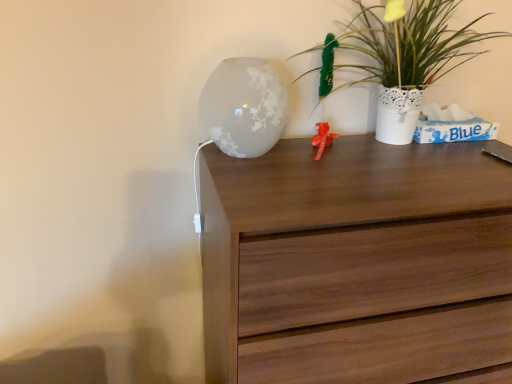
What do you see at coordinates (460, 57) in the screenshot?
I see `white textured vase at upper right` at bounding box center [460, 57].

Describe the element at coordinates (243, 107) in the screenshot. This screenshot has width=512, height=384. I see `frosted glass vase at upper center` at that location.

Where is `walnut wood chest of drawers at center`? walnut wood chest of drawers at center is located at coordinates (355, 262).

From the image's perspective, relative to white textured vase at upper right, is frosted glass vase at upper center above or below?

Based on their image positions, frosted glass vase at upper center is located beneath white textured vase at upper right.

Looking at the image, does frosted glass vase at upper center seem bigger or smaller compared to white textured vase at upper right?

Considering their sizes, frosted glass vase at upper center takes up less space than white textured vase at upper right.

Would you say frosted glass vase at upper center is a long distance from white textured vase at upper right?

Actually, frosted glass vase at upper center and white textured vase at upper right are a little close together.

Is frosted glass vase at upper center to the right of walnut wood chest of drawers at center from the viewer's perspective?

No, frosted glass vase at upper center is not to the right of walnut wood chest of drawers at center.

Is frosted glass vase at upper center surrounding walnut wood chest of drawers at center?

No, walnut wood chest of drawers at center is located outside of frosted glass vase at upper center.

Image resolution: width=512 pixels, height=384 pixels. Find the location of `chest of drawers that is on the right side of frosted glass vase at upper center`. chest of drawers that is on the right side of frosted glass vase at upper center is located at coordinates coord(355,262).

Which object is wider, white textured vase at upper right or frosted glass vase at upper center?

frosted glass vase at upper center.

From a real-world perspective, is white textured vase at upper right on frosted glass vase at upper center?

Indeed, from a real-world perspective, white textured vase at upper right stands above frosted glass vase at upper center.

What's the angular difference between white textured vase at upper right and frosted glass vase at upper center's facing directions?

The angular difference between white textured vase at upper right and frosted glass vase at upper center is 3.09 degrees.

Which of these two, white textured vase at upper right or walnut wood chest of drawers at center, stands shorter?

Standing shorter between the two is white textured vase at upper right.

Does white textured vase at upper right touch walnut wood chest of drawers at center?

No, white textured vase at upper right is not next to walnut wood chest of drawers at center.

Could you tell me if white textured vase at upper right is turned towards walnut wood chest of drawers at center?

No, white textured vase at upper right is not facing towards walnut wood chest of drawers at center.

From a real-world perspective, does white textured vase at upper right sit lower than walnut wood chest of drawers at center?

Actually, white textured vase at upper right is physically above walnut wood chest of drawers at center in the real world.

Does walnut wood chest of drawers at center appear on the right side of frosted glass vase at upper center?

Indeed, walnut wood chest of drawers at center is positioned on the right side of frosted glass vase at upper center.

Does walnut wood chest of drawers at center have a lesser width compared to frosted glass vase at upper center?

No, walnut wood chest of drawers at center is not thinner than frosted glass vase at upper center.

Which of these two, walnut wood chest of drawers at center or frosted glass vase at upper center, stands taller?

Standing taller between the two is walnut wood chest of drawers at center.

From a real-world perspective, is walnut wood chest of drawers at center physically located above or below frosted glass vase at upper center?

From a real-world perspective, walnut wood chest of drawers at center is physically below frosted glass vase at upper center.

Can you confirm if walnut wood chest of drawers at center is positioned to the right of white textured vase at upper right?

In fact, walnut wood chest of drawers at center is to the left of white textured vase at upper right.

In terms of size, does walnut wood chest of drawers at center appear bigger or smaller than white textured vase at upper right?

Considering their sizes, walnut wood chest of drawers at center takes up more space than white textured vase at upper right.

How distant is walnut wood chest of drawers at center from white textured vase at upper right?

They are 15.66 inches apart.

Looking at their sizes, would you say walnut wood chest of drawers at center is wider or thinner than white textured vase at upper right?

In the image, walnut wood chest of drawers at center appears to be wider than white textured vase at upper right.

Find the location of a particular element. houseplant located above the frosted glass vase at upper center (from the image's perspective) is located at coordinates tap(460, 57).

The height and width of the screenshot is (384, 512). What are the coordinates of `the chest of drawers lying below the frosted glass vase at upper center (from the image's perspective)` in the screenshot? It's located at coord(355,262).

Looking at the image, which one is located closer to white textured vase at upper right, walnut wood chest of drawers at center or frosted glass vase at upper center?

Among the two, walnut wood chest of drawers at center is located nearer to white textured vase at upper right.

Considering their positions, is frosted glass vase at upper center positioned further to white textured vase at upper right than walnut wood chest of drawers at center?

Among the two, frosted glass vase at upper center is located further to white textured vase at upper right.

Looking at the image, which one is located closer to walnut wood chest of drawers at center, frosted glass vase at upper center or white textured vase at upper right?

frosted glass vase at upper center is positioned closer to the anchor walnut wood chest of drawers at center.

From the image, which object appears to be farther from frosted glass vase at upper center, white textured vase at upper right or walnut wood chest of drawers at center?

white textured vase at upper right is positioned further to the anchor frosted glass vase at upper center.

Consider the image. Estimate the real-world distances between objects in this image. Which object is further from frosted glass vase at upper center, walnut wood chest of drawers at center or white textured vase at upper right?

white textured vase at upper right is positioned further to the anchor frosted glass vase at upper center.

Which object lies further to the anchor point walnut wood chest of drawers at center, white textured vase at upper right or frosted glass vase at upper center?

white textured vase at upper right lies further to walnut wood chest of drawers at center than the other object.

You are a GUI agent. You are given a task and a screenshot of the screen. Output one action in this format:
    pyautogui.click(x=<x>, y=<y>)
    Task: Click on the table lamp between white textured vase at upper right and walnut wood chest of drawers at center in the up-down direction
    
    Given the screenshot: What is the action you would take?
    pyautogui.click(x=243, y=107)